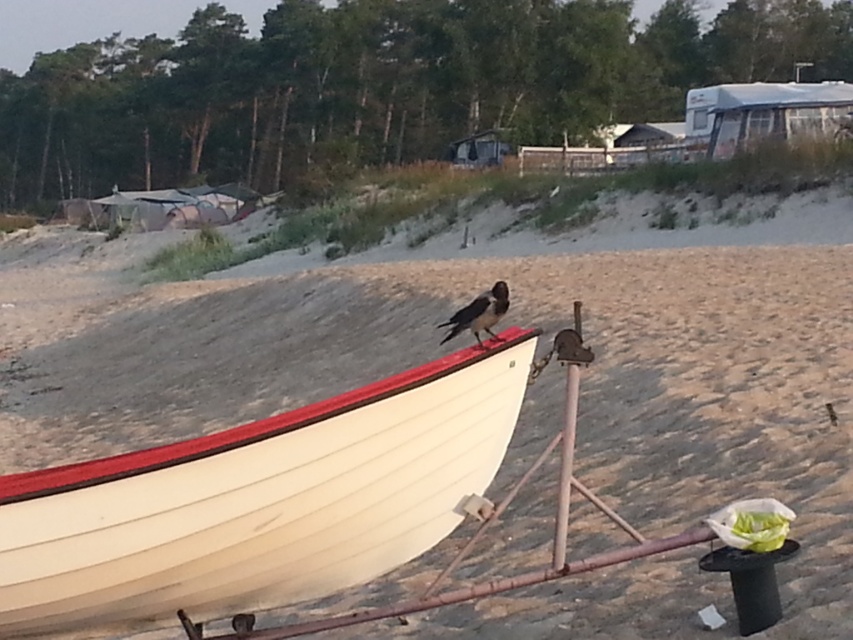
Which is in front, point (508, 336) or point (462, 324)?

Point (508, 336) is in front.

Does white wood boat at center come in front of black glossy bird at center?

Yes.

Between point (395, 474) and point (474, 321), which one is positioned in front?

Point (395, 474)

At what (x,y) coordinates should I click in order to perform the action: click on white wood boat at center. Please return your answer as a coordinate pair (x, y). The width and height of the screenshot is (853, 640). Looking at the image, I should click on (259, 502).